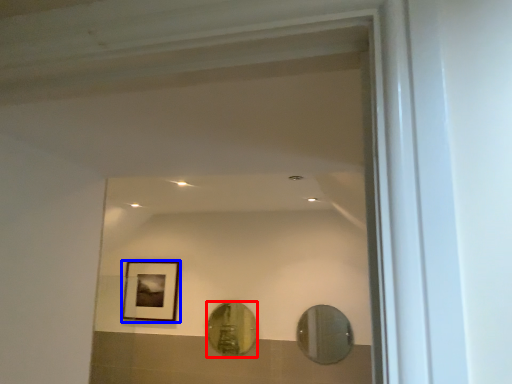
Question: Which point is further to the camera, mirror (highlighted by a red box) or picture frame (highlighted by a blue box)?

Choices:
 (A) mirror
 (B) picture frame

Answer: (B)